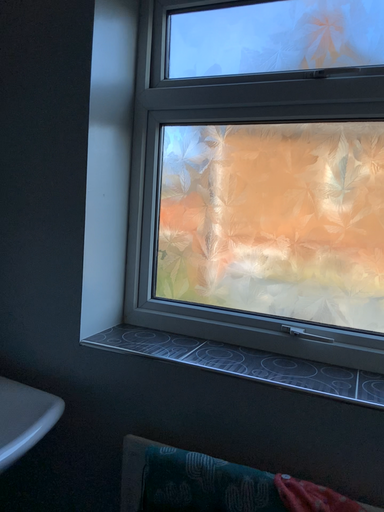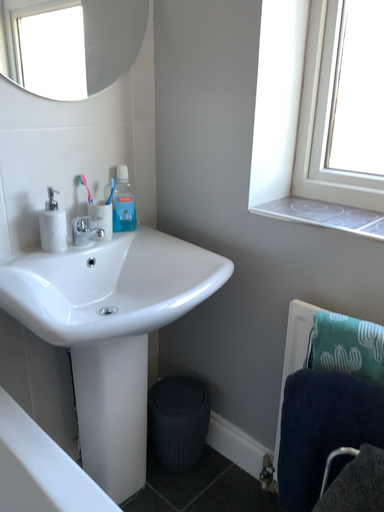
Question: Which way did the camera rotate in the video?

Choices:
 (A) rotated upward
 (B) rotated downward

Answer: (B)